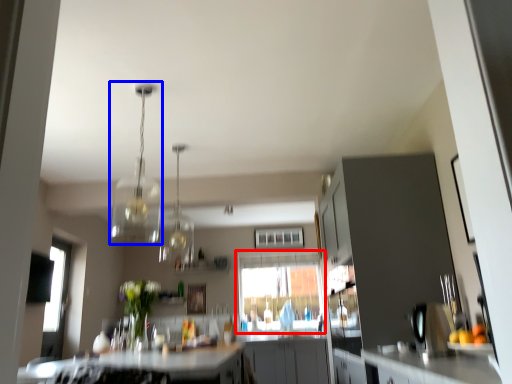
Question: Which object appears farthest to the camera in this image, window (highlighted by a red box) or light fixture (highlighted by a blue box)?

Choices:
 (A) window
 (B) light fixture

Answer: (A)